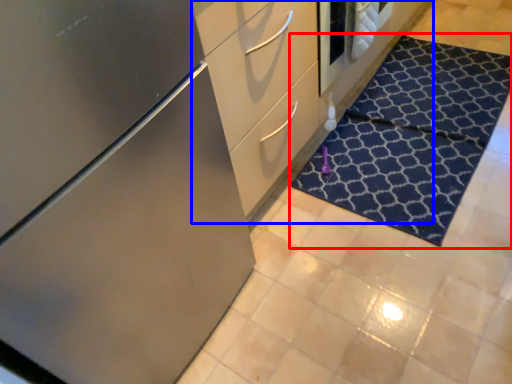
Question: Which object is closer to the camera taking this photo, doormat (highlighted by a red box) or dresser (highlighted by a blue box)?

Choices:
 (A) doormat
 (B) dresser

Answer: (B)